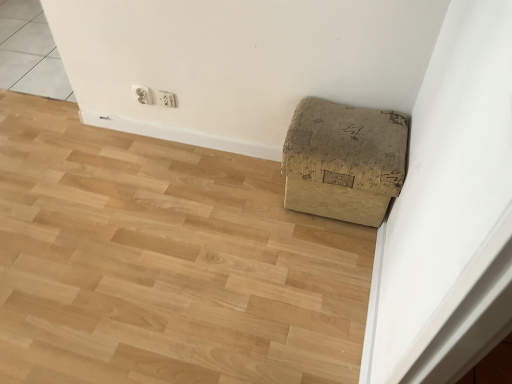
This screenshot has height=384, width=512. Describe the element at coordinates (143, 94) in the screenshot. I see `white plastic electric outlet at upper center, positioned as the 2th electric outlet in right-to-left order` at that location.

At what (x,y) coordinates should I click in order to perform the action: click on brown cardboard box at lower right. Please return your answer as a coordinate pair (x, y). The height and width of the screenshot is (384, 512). Looking at the image, I should click on (344, 161).

Is brown cardboard box at lower right aimed at white plastic electric outlet at upper center, the 2th electric outlet from the left?

Result: No, brown cardboard box at lower right does not turn towards white plastic electric outlet at upper center, the 2th electric outlet from the left.

Can you confirm if brown cardboard box at lower right is wider than white plastic electric outlet at upper center, the first electric outlet in the right-to-left sequence?

Correct, the width of brown cardboard box at lower right exceeds that of white plastic electric outlet at upper center, the first electric outlet in the right-to-left sequence.

In terms of size, does brown cardboard box at lower right appear bigger or smaller than white plastic electric outlet at upper center, the first electric outlet in the right-to-left sequence?

In the image, brown cardboard box at lower right appears to be larger than white plastic electric outlet at upper center, the first electric outlet in the right-to-left sequence.

Looking at this image, which is closer to the camera, (x=394, y=133) or (x=169, y=104)?

The point (x=394, y=133) is closer to the camera.

Does brown cardboard box at lower right have a greater width compared to brown cardboard box at lower right?

In fact, brown cardboard box at lower right might be narrower than brown cardboard box at lower right.

In terms of height, does brown cardboard box at lower right look taller or shorter compared to brown cardboard box at lower right?

brown cardboard box at lower right is taller than brown cardboard box at lower right.

Does point (346, 185) come in front of point (215, 157)?

Yes.

In the image, is brown cardboard box at lower right on the left side or the right side of brown cardboard box at lower right?

brown cardboard box at lower right is to the right of brown cardboard box at lower right.

Which is in front, point (141, 97) or point (176, 106)?

The point (176, 106) is in front.

Between white plastic electric outlet at upper center, placed as the first electric outlet when sorted from left to right, and white plastic electric outlet at upper center, the first electric outlet in the right-to-left sequence, which one has larger width?

With larger width is white plastic electric outlet at upper center, placed as the first electric outlet when sorted from left to right.

Is white plastic electric outlet at upper center, positioned as the 2th electric outlet in right-to-left order, inside or outside of white plastic electric outlet at upper center, the 2th electric outlet from the left?

white plastic electric outlet at upper center, positioned as the 2th electric outlet in right-to-left order, cannot be found inside white plastic electric outlet at upper center, the 2th electric outlet from the left.

From the image's perspective, would you say white plastic electric outlet at upper center, positioned as the 2th electric outlet in right-to-left order, is positioned over white plastic electric outlet at upper center, the first electric outlet in the right-to-left sequence?

Yes.

From a real-world perspective, which object rests below the other?

brown cardboard box at lower right, from a real-world perspective.

Find the location of a particular element. The width and height of the screenshot is (512, 384). plywood below the white plastic electric outlet at upper center, placed as the first electric outlet when sorted from left to right (from a real-world perspective) is located at coordinates (165, 262).

Does brown cardboard box at lower right appear on the left side of white plastic electric outlet at upper center, placed as the first electric outlet when sorted from left to right?

Yes.

Which object is thinner, brown cardboard box at lower right or brown cardboard box at lower right?

brown cardboard box at lower right is thinner.

Which object is closer to the camera taking this photo, brown cardboard box at lower right or brown cardboard box at lower right?

Positioned in front is brown cardboard box at lower right.

Are brown cardboard box at lower right and brown cardboard box at lower right beside each other?

There is a gap between brown cardboard box at lower right and brown cardboard box at lower right.

Which is less distant, (240, 221) or (305, 209)?

Point (240, 221) is farther from the camera than point (305, 209).

Considering the sizes of objects white plastic electric outlet at upper center, the 2th electric outlet from the left, and brown cardboard box at lower right in the image provided, who is wider, white plastic electric outlet at upper center, the 2th electric outlet from the left, or brown cardboard box at lower right?

brown cardboard box at lower right.

Are white plastic electric outlet at upper center, the 2th electric outlet from the left, and brown cardboard box at lower right located far from each other?

white plastic electric outlet at upper center, the 2th electric outlet from the left, is actually quite close to brown cardboard box at lower right.

Based on their sizes in the image, would you say white plastic electric outlet at upper center, the first electric outlet in the right-to-left sequence, is bigger or smaller than brown cardboard box at lower right?

Considering their sizes, white plastic electric outlet at upper center, the first electric outlet in the right-to-left sequence, takes up less space than brown cardboard box at lower right.

Consider the image. From a real-world perspective, who is located higher, white plastic electric outlet at upper center, the 2th electric outlet from the left, or brown cardboard box at lower right?

white plastic electric outlet at upper center, the 2th electric outlet from the left.

Does white plastic electric outlet at upper center, the first electric outlet in the right-to-left sequence, touch white plastic electric outlet at upper center, positioned as the 2th electric outlet in right-to-left order?

Yes, white plastic electric outlet at upper center, the first electric outlet in the right-to-left sequence, is touching white plastic electric outlet at upper center, positioned as the 2th electric outlet in right-to-left order.

Does white plastic electric outlet at upper center, the 2th electric outlet from the left, appear on the right side of white plastic electric outlet at upper center, placed as the first electric outlet when sorted from left to right?

Yes, white plastic electric outlet at upper center, the 2th electric outlet from the left, is to the right of white plastic electric outlet at upper center, placed as the first electric outlet when sorted from left to right.

Locate an element on the screen. This screenshot has width=512, height=384. electric outlet located on the left of white plastic electric outlet at upper center, the 2th electric outlet from the left is located at coordinates (143, 94).

Considering the relative sizes of white plastic electric outlet at upper center, the first electric outlet in the right-to-left sequence, and white plastic electric outlet at upper center, placed as the first electric outlet when sorted from left to right, in the image provided, is white plastic electric outlet at upper center, the first electric outlet in the right-to-left sequence, bigger than white plastic electric outlet at upper center, placed as the first electric outlet when sorted from left to right,?

No.

The image size is (512, 384). What are the coordinates of `the 1st electric outlet positioned above the brown cardboard box at lower right (from the image's perspective)` in the screenshot? It's located at (167, 99).

Locate an element on the screen. plywood lying on the left of brown cardboard box at lower right is located at coordinates (165, 262).

When comparing their distances from white plastic electric outlet at upper center, positioned as the 2th electric outlet in right-to-left order, does brown cardboard box at lower right or white plastic electric outlet at upper center, the first electric outlet in the right-to-left sequence, seem closer?

Based on the image, white plastic electric outlet at upper center, the first electric outlet in the right-to-left sequence, appears to be nearer to white plastic electric outlet at upper center, positioned as the 2th electric outlet in right-to-left order.

Which object lies further to the anchor point white plastic electric outlet at upper center, the first electric outlet in the right-to-left sequence, brown cardboard box at lower right or white plastic electric outlet at upper center, placed as the first electric outlet when sorted from left to right?

Among the two, brown cardboard box at lower right is located further to white plastic electric outlet at upper center, the first electric outlet in the right-to-left sequence.

Based on their spatial positions, is white plastic electric outlet at upper center, the first electric outlet in the right-to-left sequence, or brown cardboard box at lower right closer to brown cardboard box at lower right?

The object closer to brown cardboard box at lower right is brown cardboard box at lower right.

Consider the image. Based on their spatial positions, is brown cardboard box at lower right or brown cardboard box at lower right further from white plastic electric outlet at upper center, positioned as the 2th electric outlet in right-to-left order?

The object further to white plastic electric outlet at upper center, positioned as the 2th electric outlet in right-to-left order, is brown cardboard box at lower right.

Looking at the image, which one is located further to brown cardboard box at lower right, brown cardboard box at lower right or white plastic electric outlet at upper center, the first electric outlet in the right-to-left sequence?

Based on the image, white plastic electric outlet at upper center, the first electric outlet in the right-to-left sequence, appears to be further to brown cardboard box at lower right.

Based on their spatial positions, is brown cardboard box at lower right or brown cardboard box at lower right further from white plastic electric outlet at upper center, the first electric outlet in the right-to-left sequence?

The object further to white plastic electric outlet at upper center, the first electric outlet in the right-to-left sequence, is brown cardboard box at lower right.

Consider the image. Looking at the image, which one is located closer to brown cardboard box at lower right, white plastic electric outlet at upper center, placed as the first electric outlet when sorted from left to right, or brown cardboard box at lower right?

brown cardboard box at lower right is positioned closer to the anchor brown cardboard box at lower right.

Which object lies nearer to the anchor point white plastic electric outlet at upper center, placed as the first electric outlet when sorted from left to right, white plastic electric outlet at upper center, the 2th electric outlet from the left, or brown cardboard box at lower right?

→ white plastic electric outlet at upper center, the 2th electric outlet from the left, lies closer to white plastic electric outlet at upper center, placed as the first electric outlet when sorted from left to right, than the other object.

The image size is (512, 384). What are the coordinates of `electric outlet between white plastic electric outlet at upper center, positioned as the 2th electric outlet in right-to-left order, and brown cardboard box at lower right, in the horizontal direction` in the screenshot? It's located at (167, 99).

Locate an element on the screen. electric outlet located between brown cardboard box at lower right and white plastic electric outlet at upper center, placed as the first electric outlet when sorted from left to right, in the depth direction is located at coordinates (167, 99).